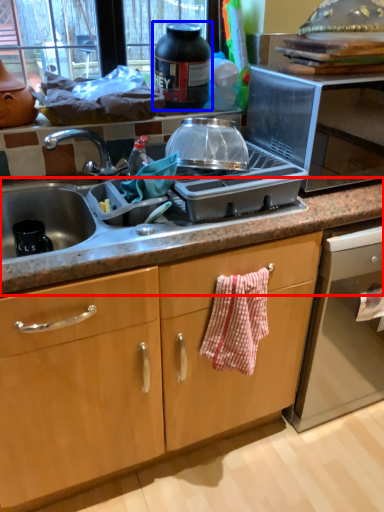
Question: Which object appears closest to the camera in this image, countertop (highlighted by a red box) or kitchen appliance (highlighted by a blue box)?

Choices:
 (A) countertop
 (B) kitchen appliance

Answer: (A)